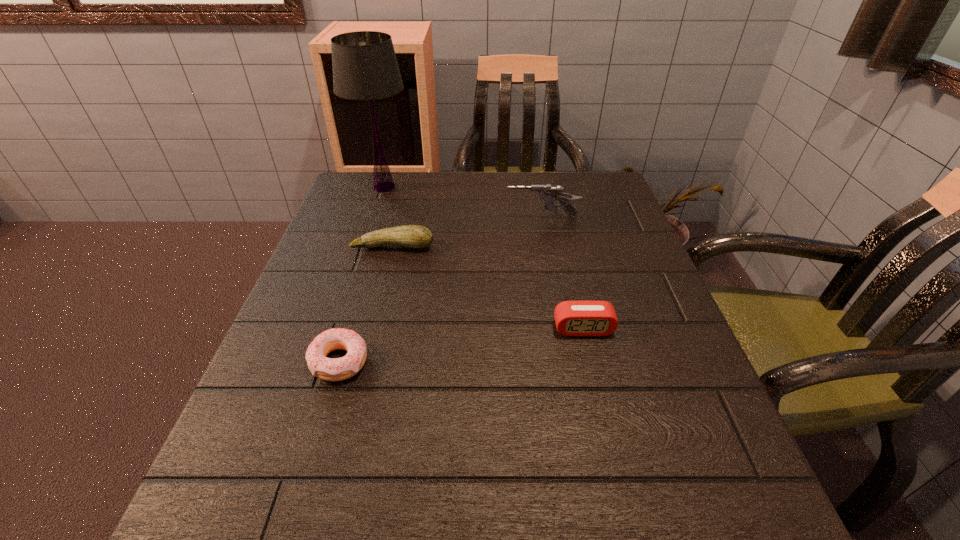
Identify the location of the tallest object. The image size is (960, 540). (365, 68).

You are a GUI agent. You are given a task and a screenshot of the screen. Output one action in this format:
    pyautogui.click(x=<x>, y=<y>)
    Task: Click on the lampshade
    
    Given the screenshot: What is the action you would take?
    pyautogui.click(x=365, y=68)

What are the coordinates of `the second farthest object` in the screenshot? It's located at (548, 193).

In order to click on gun in this screenshot , I will do `click(548, 193)`.

The width and height of the screenshot is (960, 540). I want to click on the fourth farthest object, so click(x=573, y=318).

You are a GUI agent. You are given a task and a screenshot of the screen. Output one action in this format:
    pyautogui.click(x=<x>, y=<y>)
    Task: Click on the third nearest object
    
    Given the screenshot: What is the action you would take?
    [x=412, y=236]

I want to click on the shortest object, so click(330, 369).

Where is `doughnut`? The image size is (960, 540). doughnut is located at coordinates (330, 369).

Find the location of a particular element. The width and height of the screenshot is (960, 540). vacant space located on the front-facing side of the tallest object is located at coordinates pyautogui.click(x=474, y=187).

This screenshot has height=540, width=960. In order to click on vacant region located at the barrel of the fourth nearest object in this screenshot , I will do `click(427, 218)`.